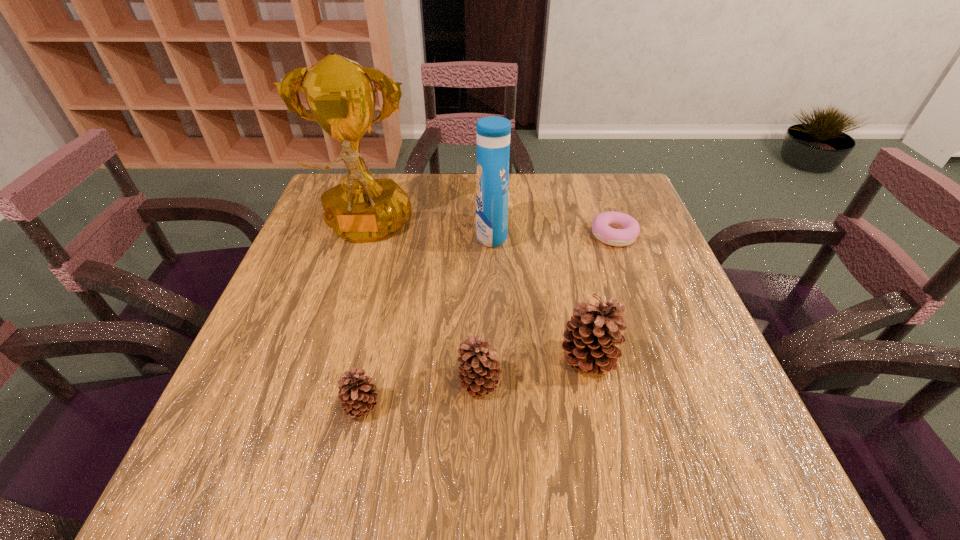
You are a GUI agent. You are given a task and a screenshot of the screen. Output one action in this format:
    pyautogui.click(x=<x>, y=<y>)
    Task: Click on the free space between the fifth tallest object and the pastry
    
    Given the screenshot: What is the action you would take?
    pyautogui.click(x=488, y=322)

At what (x,y) coordinates should I click in order to perform the action: click on empty location between the fifth shortest object and the award. Please return your answer as a coordinate pair (x, y). This screenshot has width=960, height=540. Looking at the image, I should click on (428, 233).

Identify the location of empty location between the third shortest object and the rightmost object. This screenshot has width=960, height=540. (547, 309).

This screenshot has width=960, height=540. I want to click on vacant space in between the second tallest object and the second pinecone from right to left, so click(x=486, y=308).

Locate an element on the screen. The height and width of the screenshot is (540, 960). free space between the second pinecone from right to left and the second tallest object is located at coordinates (486, 308).

At what (x,y) coordinates should I click in order to perform the action: click on vacant space that is in between the rightmost object and the third shortest object. Please return your answer as a coordinate pair (x, y). This screenshot has height=540, width=960. Looking at the image, I should click on (547, 309).

This screenshot has width=960, height=540. In order to click on free space that is in between the second tallest object and the award in this screenshot , I will do `click(428, 233)`.

Identify the location of object that stands as the fifth closest to the tallest object. (603, 227).

Locate which object is the fourth closest to the shortest pinecone. Please provide its 2D coordinates. Your answer should be formatted as a tuple, i.e. [(x, y)], where the tuple contains the x and y coordinates of a point satisfying the conditions above.

[(493, 133)]

What are the coordinates of `pinecone that is the second closest one to the detergent` in the screenshot? It's located at (478, 373).